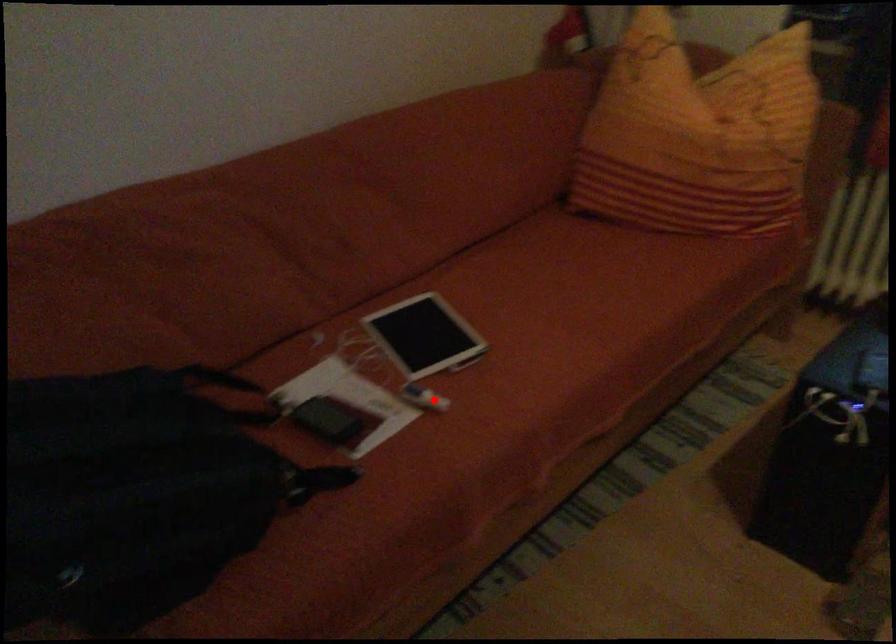
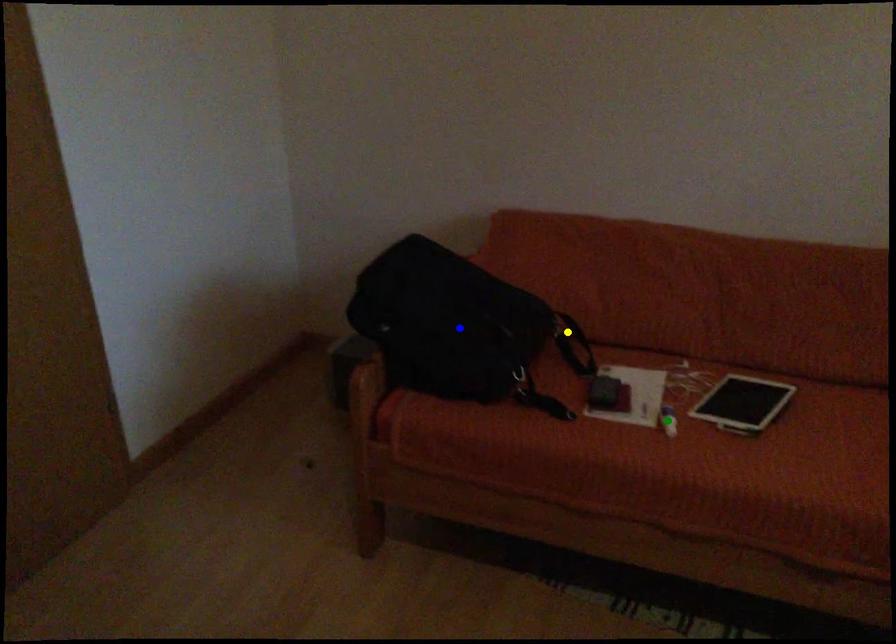
Question: I am providing you with two images of the same scene from different viewpoints. A red point is marked on the first image. You are given multiple points on the second image. Which spot in image 2 lines up with the point in image 1?

Choices:
 (A) blue point
 (B) yellow point
 (C) green point

Answer: (C)